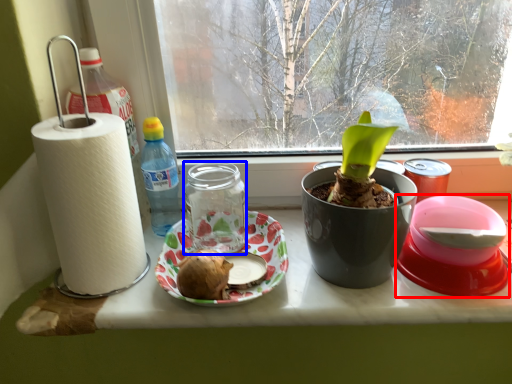
Question: Which object appears farthest to the camera in this image, appliance (highlighted by a red box) or glass jar (highlighted by a blue box)?

Choices:
 (A) appliance
 (B) glass jar

Answer: (B)